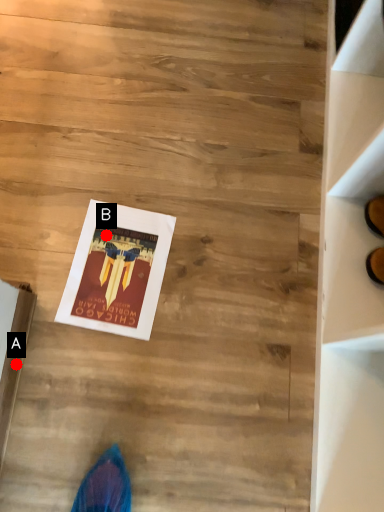
Question: Two points are circled on the image, labeled by A and B beside each circle. Which point is farther from the camera taking this photo?

Choices:
 (A) A is further
 (B) B is further

Answer: (B)